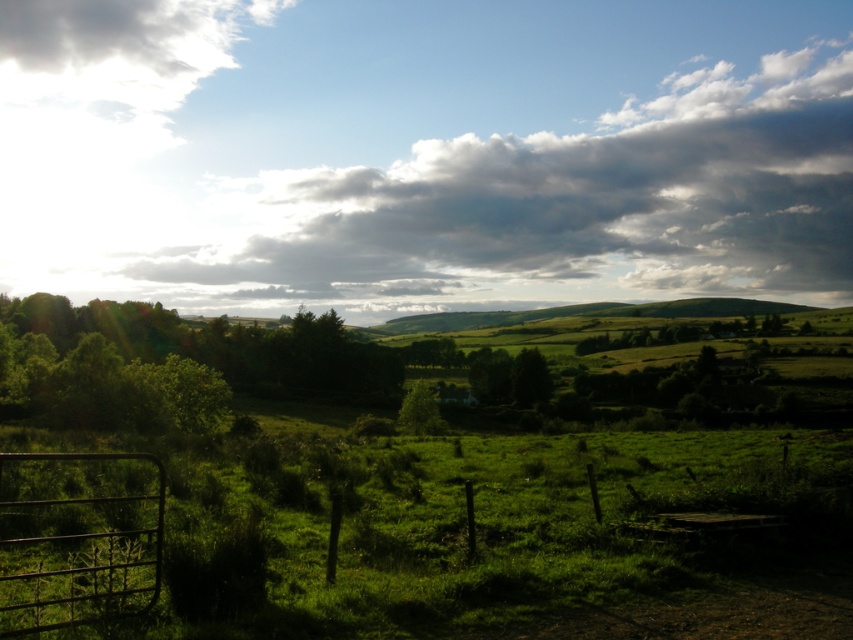
Does white fluffy cloud at upper center appear over rusty metal gate at lower left?

Yes.

Can you confirm if white fluffy cloud at upper center is shorter than rusty metal gate at lower left?

No.

Is point (727, 221) positioned behind point (38, 452)?

Yes, it is behind point (38, 452).

Identify the location of white fluffy cloud at upper center. (553, 205).

Does point (152, 550) come in front of point (402, 419)?

Yes, it is.

What do you see at coordinates (77, 538) in the screenshot?
I see `rusty metal gate at lower left` at bounding box center [77, 538].

Locate an element on the screen. The width and height of the screenshot is (853, 640). rusty metal gate at lower left is located at coordinates (77, 538).

Locate an element on the screen. rusty metal gate at lower left is located at coordinates (77, 538).

Can you confirm if white fluffy cloud at upper center is positioned below green leafy tree at center?

No.

Is white fluffy cloud at upper center positioned before green leafy tree at center?

No, it is behind green leafy tree at center.

Between point (705, 269) and point (415, 406), which one is positioned behind?

The point (705, 269) is more distant.

Locate an element on the screen. The height and width of the screenshot is (640, 853). white fluffy cloud at upper center is located at coordinates (553, 205).